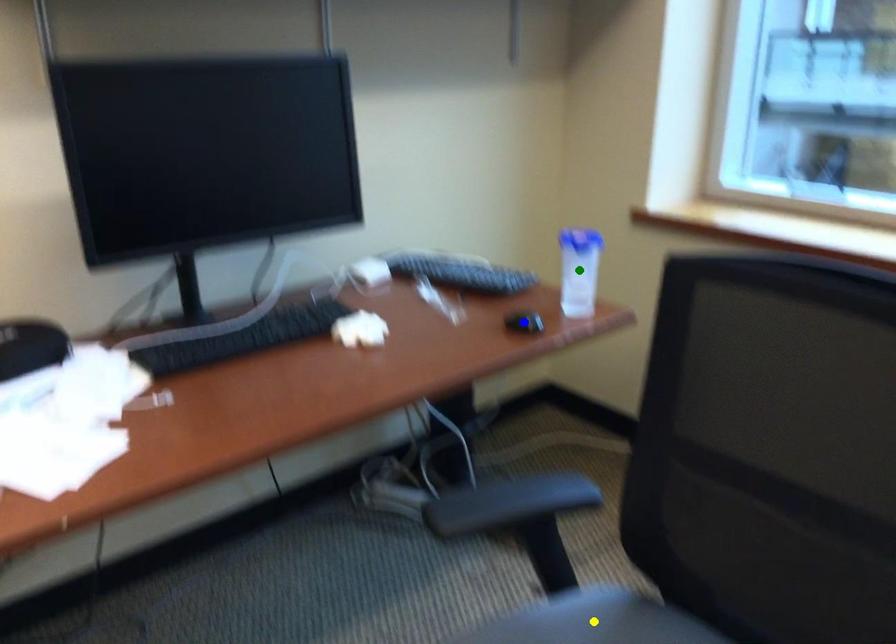
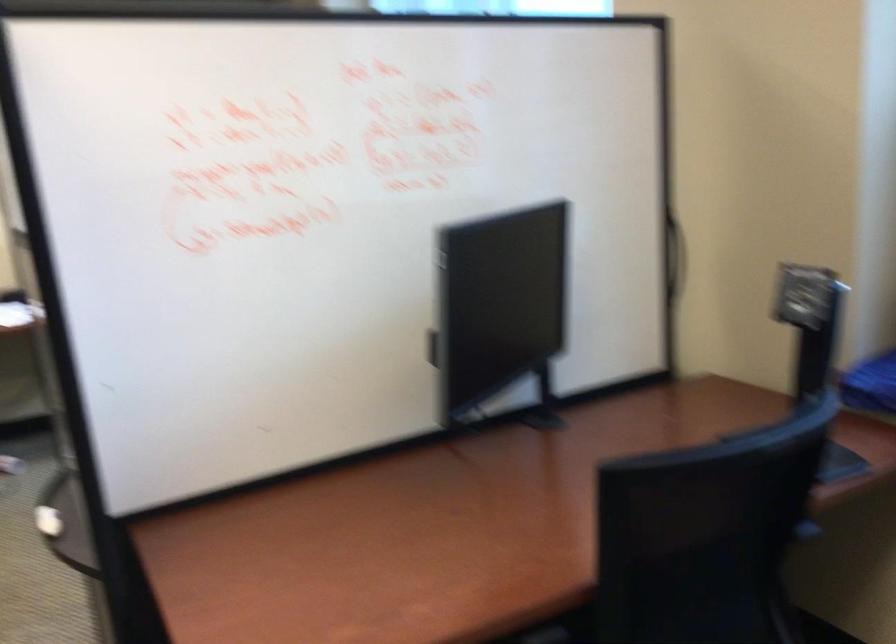
I am providing you with two images of the same scene from different viewpoints. Three points are marked in image1. Which point corresponds to a part or object that is occluded in image2?In image1, three points are marked. Which of them correspond to a part or object that is occluded in image2?Among the three points shown in image1, which one corresponds to a part or object that is no longer visible due to occlusion in image2?

blue point, green point, yellow point